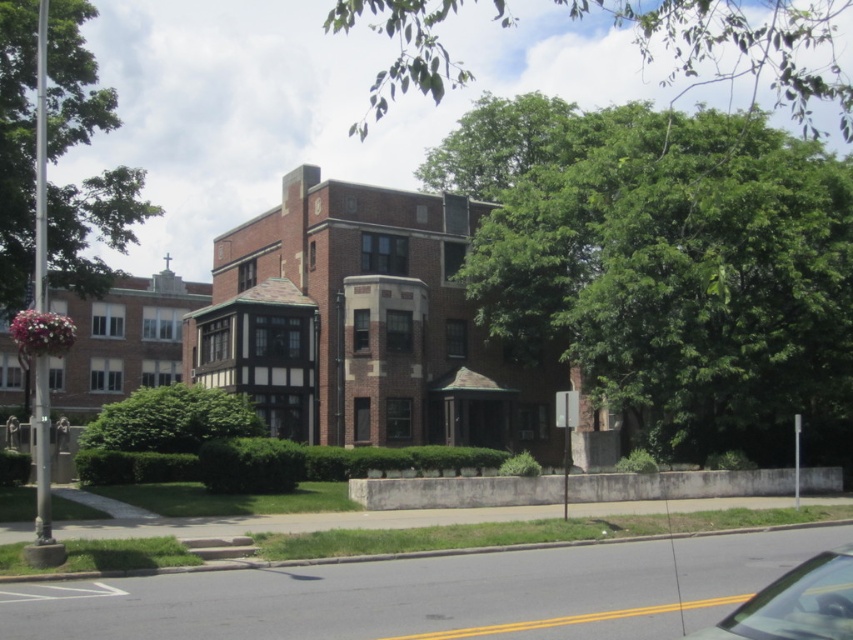
Question: Is green leafy tree at upper center positioned behind green leafy tree at upper left?

Choices:
 (A) yes
 (B) no

Answer: (B)

Question: Which of the following is the farthest from the observer?

Choices:
 (A) green leafy tree at center
 (B) metallic silver car at lower right

Answer: (A)

Question: Does green leafy tree at upper center have a smaller size compared to metallic silver car at lower right?

Choices:
 (A) no
 (B) yes

Answer: (A)

Question: Which point is farther to the camera?

Choices:
 (A) (764, 456)
 (B) (134, 429)
 (C) (767, 604)
 (D) (735, 6)

Answer: (D)

Question: Is green leafy tree at center further to the viewer compared to green leafy tree at upper center?

Choices:
 (A) no
 (B) yes

Answer: (B)

Question: Which is nearer to the green leafy tree at upper center?

Choices:
 (A) green leafy tree at center
 (B) green leafy bush at center

Answer: (A)